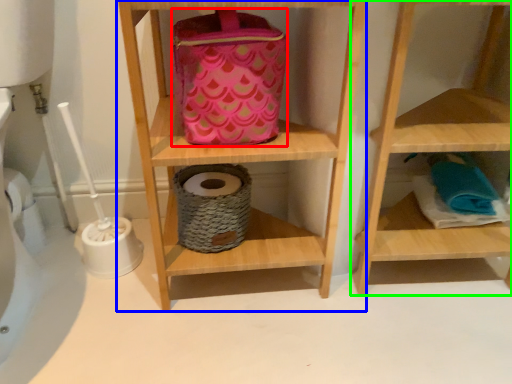
Question: Considering the real-world distances, which object is closest to pouch (highlighted by a red box)? shelf (highlighted by a blue box) or shelf (highlighted by a green box).

Choices:
 (A) shelf
 (B) shelf

Answer: (A)